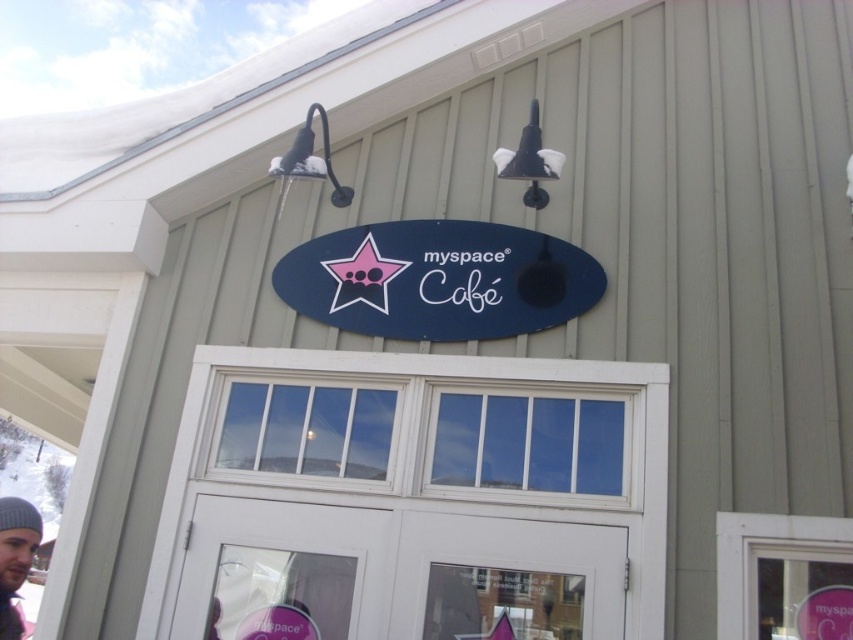
Looking at this image, you are a customer entering the myspace Cafe and notice the matte blue sign at center and the gray knit beanie at lower left. Which object is positioned higher on the building facade?

The matte blue sign at center is positioned higher on the building facade than the gray knit beanie at lower left.

You are standing in front of the myspace Cafe building and want to touch both the matte blue sign at center and the gray knit beanie at lower left. Which object will you reach first?

The matte blue sign at center is closer to you than the gray knit beanie at lower left, so you will reach the matte blue sign at center first.

Based on the scene description, can you determine if the white wooden door at center is wider than the matte blue sign at center?

The white wooden door at center might be wider than matte blue sign at center according to the description.